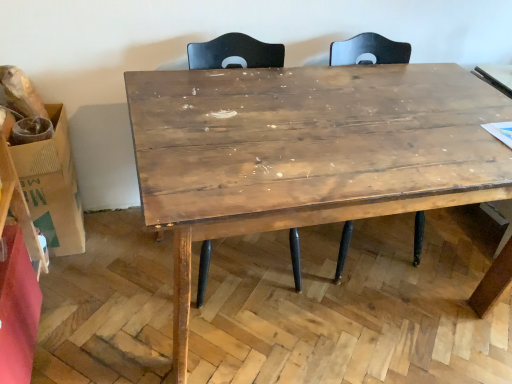
Question: From a real-world perspective, is brown cardboard box at left beneath wooden table at center?

Choices:
 (A) yes
 (B) no

Answer: (A)

Question: Is brown cardboard box at left behind wooden table at center?

Choices:
 (A) no
 (B) yes

Answer: (B)

Question: Is brown cardboard box at left oriented away from wooden table at center?

Choices:
 (A) no
 (B) yes

Answer: (A)

Question: Can you confirm if brown cardboard box at left is wider than wooden table at center?

Choices:
 (A) no
 (B) yes

Answer: (A)

Question: Is brown cardboard box at left touching wooden table at center?

Choices:
 (A) yes
 (B) no

Answer: (B)

Question: Would you say wooden table at center is to the left or to the right of matte wood swivel chair at center in the picture?

Choices:
 (A) left
 (B) right

Answer: (B)

Question: Based on their sizes in the image, would you say wooden table at center is bigger or smaller than matte wood swivel chair at center?

Choices:
 (A) big
 (B) small

Answer: (A)

Question: From the image's perspective, is wooden table at center located above or below matte wood swivel chair at center?

Choices:
 (A) above
 (B) below

Answer: (B)

Question: Is point (381, 114) positioned closer to the camera than point (197, 56)?

Choices:
 (A) farther
 (B) closer

Answer: (B)

Question: Considering their positions, is matte wood swivel chair at center located in front of or behind wooden table at center?

Choices:
 (A) front
 (B) behind

Answer: (B)

Question: From a real-world perspective, is matte wood swivel chair at center above or below wooden table at center?

Choices:
 (A) above
 (B) below

Answer: (A)

Question: Which is correct: matte wood swivel chair at center is inside wooden table at center, or outside of it?

Choices:
 (A) outside
 (B) inside

Answer: (B)

Question: Considering the positions of matte wood swivel chair at center and wooden table at center in the image, is matte wood swivel chair at center wider or thinner than wooden table at center?

Choices:
 (A) thin
 (B) wide

Answer: (A)

Question: Considering the positions of wooden table at center and brown cardboard box at left in the image, is wooden table at center bigger or smaller than brown cardboard box at left?

Choices:
 (A) small
 (B) big

Answer: (B)

Question: Is wooden table at center taller or shorter than brown cardboard box at left?

Choices:
 (A) tall
 (B) short

Answer: (A)